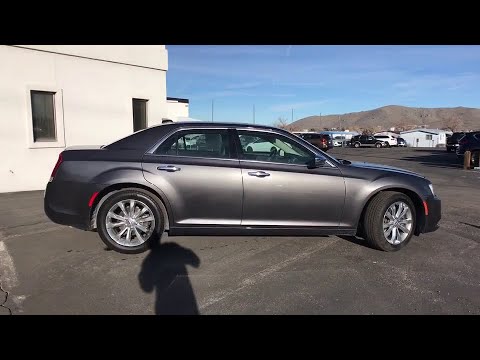
What are the coordinates of `window` in the screenshot? It's located at (46, 104).